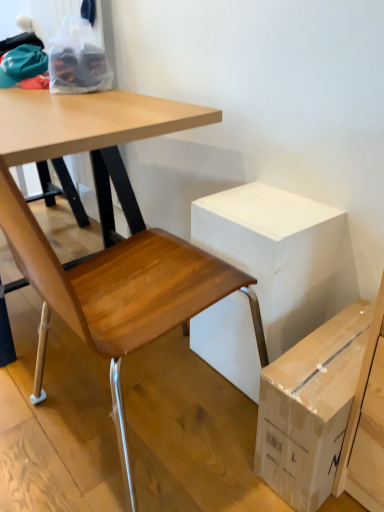
Question: Is white cardboard box at center shorter than wooden chair at lower left?

Choices:
 (A) no
 (B) yes

Answer: (B)

Question: From the image's perspective, does white cardboard box at center appear higher than wooden chair at lower left?

Choices:
 (A) no
 (B) yes

Answer: (A)

Question: From a real-world perspective, is white cardboard box at center over wooden chair at lower left?

Choices:
 (A) no
 (B) yes

Answer: (A)

Question: Does white cardboard box at center come behind wooden chair at lower left?

Choices:
 (A) yes
 (B) no

Answer: (A)

Question: Is white cardboard box at center taller than wooden chair at lower left?

Choices:
 (A) no
 (B) yes

Answer: (A)

Question: Considering their positions, is wooden chair at lower left located in front of or behind brown cardboard box at lower right?

Choices:
 (A) front
 (B) behind

Answer: (A)

Question: Is wooden chair at lower left inside the boundaries of brown cardboard box at lower right, or outside?

Choices:
 (A) inside
 (B) outside

Answer: (B)

Question: Considering the positions of wooden chair at lower left and brown cardboard box at lower right in the image, is wooden chair at lower left wider or thinner than brown cardboard box at lower right?

Choices:
 (A) wide
 (B) thin

Answer: (A)

Question: Does point (125, 323) appear closer or farther from the camera than point (301, 416)?

Choices:
 (A) farther
 (B) closer

Answer: (A)

Question: Is wooden chair at lower left to the left or to the right of white cardboard box at center in the image?

Choices:
 (A) left
 (B) right

Answer: (A)

Question: From the image's perspective, is wooden chair at lower left located above or below white cardboard box at center?

Choices:
 (A) below
 (B) above

Answer: (B)

Question: Is wooden chair at lower left taller or shorter than white cardboard box at center?

Choices:
 (A) short
 (B) tall

Answer: (B)

Question: Choose the correct answer: Is wooden chair at lower left inside white cardboard box at center or outside it?

Choices:
 (A) inside
 (B) outside

Answer: (B)

Question: Considering the relative positions of white cardboard box at center and wooden chair at lower left in the image provided, is white cardboard box at center to the left or to the right of wooden chair at lower left?

Choices:
 (A) left
 (B) right

Answer: (B)

Question: Considering their positions, is white cardboard box at center located in front of or behind wooden chair at lower left?

Choices:
 (A) behind
 (B) front

Answer: (A)